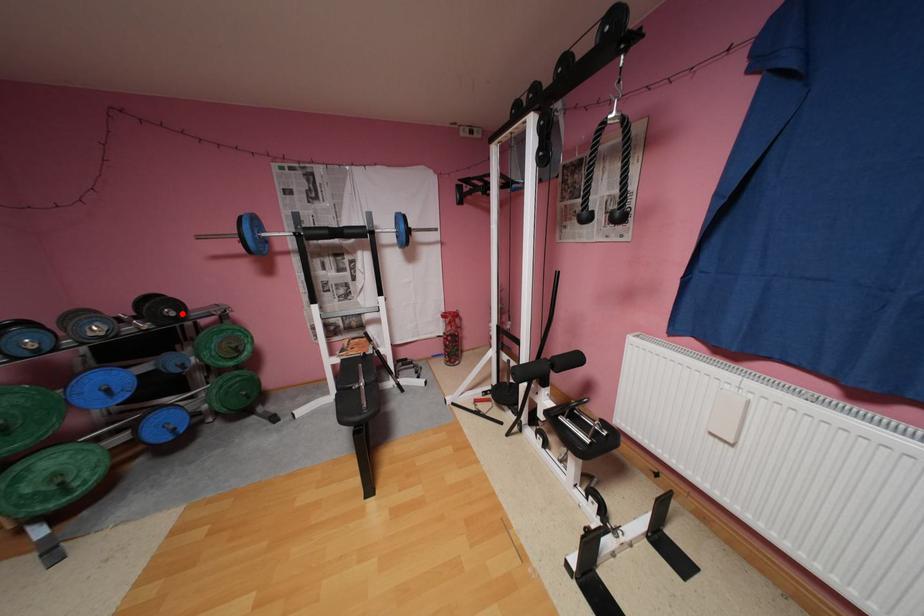
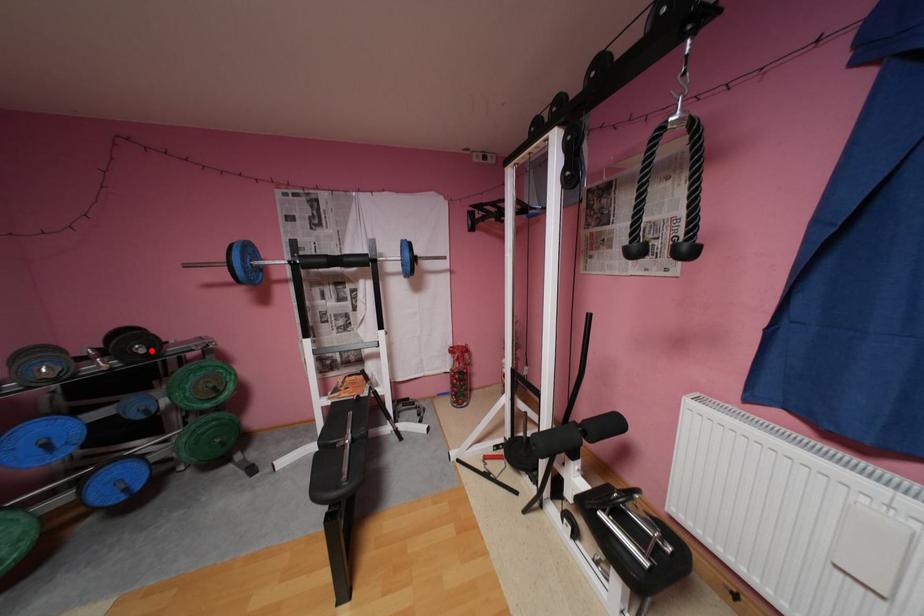
I am providing you with two images of the same scene from different viewpoints. A red point is marked on the first image and another point is marked on the second image. Is the marked point in image1 the same physical position as the marked point in image2?

Yes